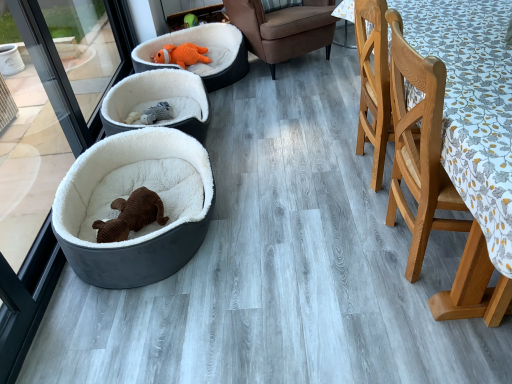
Question: Which direction should I rotate to look at orange plush dog bed at upper center, which appears as the 3th dog bed when viewed from the front?

Choices:
 (A) right
 (B) left

Answer: (B)

Question: Considering the relative sizes of light brown wooden chair at right, which is the first chair in front-to-back order, and orange plush dog bed at upper center, arranged as the 1th dog bed when viewed from the back, in the image provided, is light brown wooden chair at right, which is the first chair in front-to-back order, wider than orange plush dog bed at upper center, arranged as the 1th dog bed when viewed from the back,?

Choices:
 (A) no
 (B) yes

Answer: (A)

Question: Is light brown wooden chair at right, the 1th chair when ordered from bottom to top, oriented towards orange plush dog bed at upper center, which appears as the 3th dog bed when viewed from the front?

Choices:
 (A) yes
 (B) no

Answer: (B)

Question: Is light brown wooden chair at right, the 1th chair when ordered from bottom to top, to the left of orange plush dog bed at upper center, arranged as the 1th dog bed when viewed from the back, from the viewer's perspective?

Choices:
 (A) no
 (B) yes

Answer: (A)

Question: Is the position of light brown wooden chair at right, which is the first chair in front-to-back order, less distant than that of orange plush dog bed at upper center, arranged as the 1th dog bed when viewed from the back?

Choices:
 (A) yes
 (B) no

Answer: (A)

Question: From a real-world perspective, is light brown wooden chair at right, the 2th chair in the top-to-bottom sequence, physically below orange plush dog bed at upper center, arranged as the 1th dog bed when viewed from the back?

Choices:
 (A) yes
 (B) no

Answer: (B)

Question: From the image's perspective, is light brown wooden chair at right, the 2th chair in the top-to-bottom sequence, located beneath orange plush dog bed at upper center, arranged as the 1th dog bed when viewed from the back?

Choices:
 (A) yes
 (B) no

Answer: (A)

Question: Considering the relative sizes of velvet brown dog bed at left, acting as the 3th dog bed starting from the back, and white plush dog bed at center, the 2th dog bed when ordered from back to front, in the image provided, is velvet brown dog bed at left, acting as the 3th dog bed starting from the back, wider than white plush dog bed at center, the 2th dog bed when ordered from back to front,?

Choices:
 (A) no
 (B) yes

Answer: (A)

Question: Can you confirm if velvet brown dog bed at left, which is counted as the first dog bed, starting from the front, is thinner than white plush dog bed at center, the 2th dog bed viewed from the front?

Choices:
 (A) yes
 (B) no

Answer: (A)

Question: Is velvet brown dog bed at left, acting as the 3th dog bed starting from the back, positioned beyond the bounds of white plush dog bed at center, the 2th dog bed viewed from the front?

Choices:
 (A) yes
 (B) no

Answer: (A)

Question: Is the depth of velvet brown dog bed at left, acting as the 3th dog bed starting from the back, greater than that of white plush dog bed at center, the 2th dog bed when ordered from back to front?

Choices:
 (A) no
 (B) yes

Answer: (A)

Question: Does velvet brown dog bed at left, acting as the 3th dog bed starting from the back, have a greater height compared to white plush dog bed at center, the 2th dog bed viewed from the front?

Choices:
 (A) no
 (B) yes

Answer: (B)

Question: Is velvet brown dog bed at left, acting as the 3th dog bed starting from the back, turned away from white plush dog bed at center, the 2th dog bed viewed from the front?

Choices:
 (A) no
 (B) yes

Answer: (A)

Question: From a real-world perspective, is white plush dog bed at center, the 2th dog bed when ordered from back to front, located higher than light brown wooden chair at right, which is the first chair in front-to-back order?

Choices:
 (A) no
 (B) yes

Answer: (A)